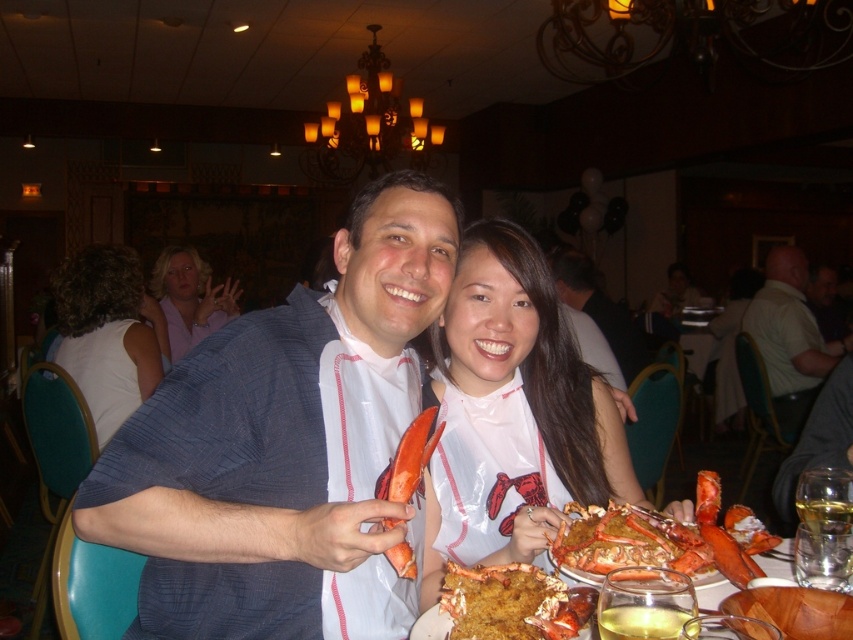
You are a photographer standing in the banquet hall and want to take a picture of both the white fabric shirt at left and the matte white shirt at center. Which shirt should you adjust your camera angle to focus on first if you want to capture both in the frame?

The white fabric shirt at left is to the left of matte white shirt at center, so you should focus on the white fabric shirt at left first to ensure both are in the frame.

You are a photographer trying to capture a closeup of the shiny orange lobster at lower right without including the matte white shirt at center in the frame. Given their sizes, is this possible?

The shiny orange lobster at lower right is smaller in width than the matte white shirt at center, so it might be possible to frame the lobster without including the shirt if positioned correctly.

Consider the image. You are standing in the banquet hall and see the point at coordinates (790,337). What object is located at that point?

The point at coordinates (790,337) is on the light green shirt at center.